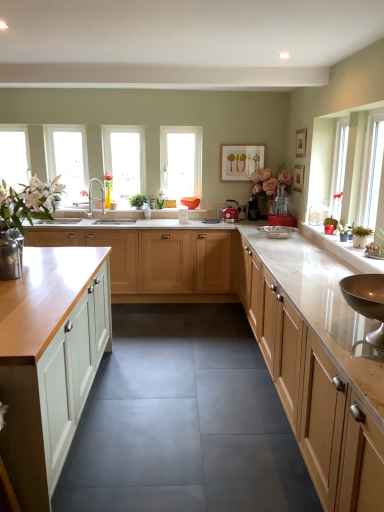
Question: Should I look upward or downward to see white matte vase at left?

Choices:
 (A) up
 (B) down

Answer: (A)

Question: Is white matte picture frame at upper center, acting as the third picture frame starting from the right, surrounded by metallic silver kettle at center, the 2th appliance when ordered from right to left?

Choices:
 (A) no
 (B) yes

Answer: (A)

Question: Can you confirm if metallic silver kettle at center, the second appliance viewed from the left, is shorter than white matte picture frame at upper center, the 3th picture frame in the front-to-back sequence?

Choices:
 (A) no
 (B) yes

Answer: (B)

Question: From the image's perspective, does metallic silver kettle at center, the 2th appliance when ordered from right to left, appear lower than white matte picture frame at upper center, the first picture frame in the back-to-front sequence?

Choices:
 (A) yes
 (B) no

Answer: (A)

Question: Can you confirm if metallic silver kettle at center, placed as the 3th appliance when sorted from front to back, is wider than white matte picture frame at upper center, the first picture frame in the back-to-front sequence?

Choices:
 (A) yes
 (B) no

Answer: (A)

Question: Is metallic silver kettle at center, the 2th appliance when ordered from right to left, next to white matte picture frame at upper center, marked as the first picture frame in a left-to-right arrangement, and touching it?

Choices:
 (A) yes
 (B) no

Answer: (B)

Question: Can you confirm if metallic silver kettle at center, the 2th appliance when ordered from right to left, is positioned to the left of white matte picture frame at upper center, the 3th picture frame in the front-to-back sequence?

Choices:
 (A) no
 (B) yes

Answer: (A)

Question: Considering the relative sizes of white painted wood cabinet at left, placed as the first cabinetry when sorted from left to right, and clear glass window at left, marked as the third window in a right-to-left arrangement, in the image provided, is white painted wood cabinet at left, placed as the first cabinetry when sorted from left to right, taller than clear glass window at left, marked as the third window in a right-to-left arrangement,?

Choices:
 (A) no
 (B) yes

Answer: (B)

Question: Does white painted wood cabinet at left, placed as the first cabinetry when sorted from left to right, have a larger size compared to clear glass window at left, marked as the first window in a left-to-right arrangement?

Choices:
 (A) no
 (B) yes

Answer: (B)

Question: Considering the relative sizes of white painted wood cabinet at left, placed as the first cabinetry when sorted from left to right, and clear glass window at left, marked as the first window in a left-to-right arrangement, in the image provided, is white painted wood cabinet at left, placed as the first cabinetry when sorted from left to right, smaller than clear glass window at left, marked as the first window in a left-to-right arrangement,?

Choices:
 (A) no
 (B) yes

Answer: (A)

Question: Is white painted wood cabinet at left, placed as the first cabinetry when sorted from left to right, thinner than clear glass window at left, marked as the first window in a left-to-right arrangement?

Choices:
 (A) yes
 (B) no

Answer: (B)

Question: Is clear glass window at left, marked as the first window in a left-to-right arrangement, at the back of white painted wood cabinet at left, which ranks as the 3th cabinetry in right-to-left order?

Choices:
 (A) yes
 (B) no

Answer: (B)

Question: Is the depth of white painted wood cabinet at left, which ranks as the 3th cabinetry in right-to-left order, less than that of clear glass window at left, marked as the first window in a left-to-right arrangement?

Choices:
 (A) yes
 (B) no

Answer: (A)

Question: From the image's perspective, is light wood cabinet at right, the third cabinetry when ordered from left to right, located above clear glass window at center, which appears as the 1th window when viewed from the right?

Choices:
 (A) yes
 (B) no

Answer: (B)